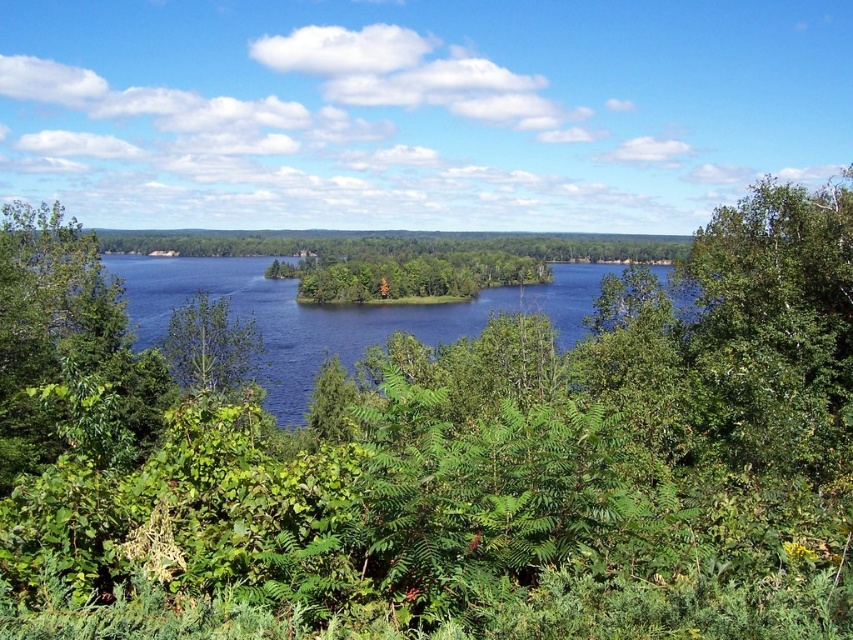
You are standing at the edge of the lake and want to take a photo of the green leafy tree at center and the blue water at center. Which object will appear closer to you in the photo?

The blue water at center will appear closer to you in the photo because the green leafy tree at center is behind it.

You are standing at point [62,337] in the image. What object is located to your immediate left?

The green leafy tree at left is located to your immediate left at point [62,337].